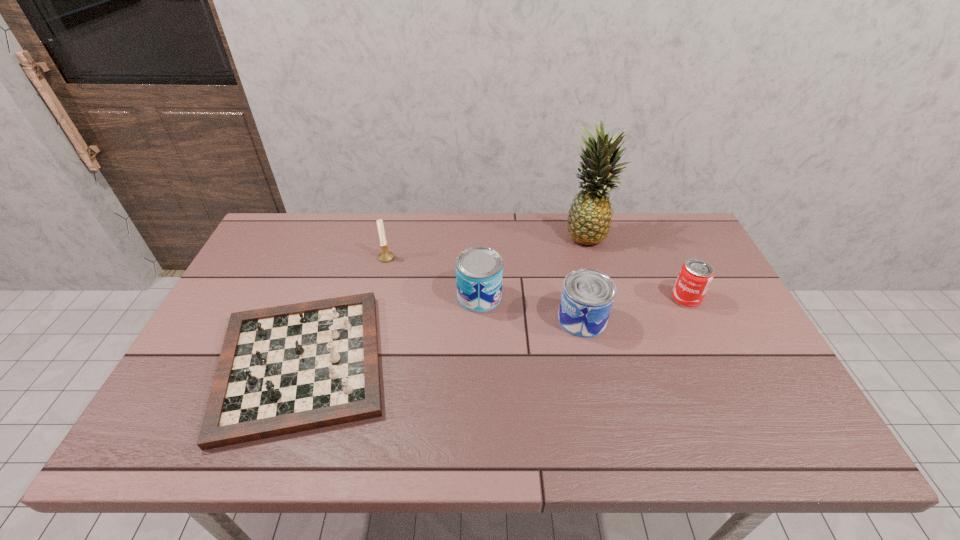
This screenshot has height=540, width=960. What are the coordinates of `vacant space located 0.240m on the front label of the second can from right to left` in the screenshot? It's located at (470, 320).

Where is `vacant region located 0.370m on the front label of the second can from right to left`? vacant region located 0.370m on the front label of the second can from right to left is located at coordinates (423, 320).

In order to click on free space located 0.300m on the front label of the second can from right to left in this screenshot , I will do `click(449, 320)`.

This screenshot has height=540, width=960. I want to click on blank space located on the right of the rightmost object, so click(x=728, y=299).

This screenshot has width=960, height=540. In order to click on free location located on the back of the chessboard in this screenshot , I will do `click(338, 260)`.

Locate an element on the screen. This screenshot has height=540, width=960. pineapple that is at the far edge is located at coordinates (589, 218).

Identify the location of candle holder that is positioned at the far edge. (385, 256).

You are a GUI agent. You are given a task and a screenshot of the screen. Output one action in this format:
    pyautogui.click(x=<x>, y=<y>)
    Task: Click on the object that is at the near edge
    The image size is (960, 540).
    Given the screenshot: What is the action you would take?
    pyautogui.click(x=286, y=369)

Where is `object at the left edge`? This screenshot has width=960, height=540. object at the left edge is located at coordinates (286, 369).

This screenshot has height=540, width=960. Find the location of `object that is at the right edge`. object that is at the right edge is located at coordinates (695, 276).